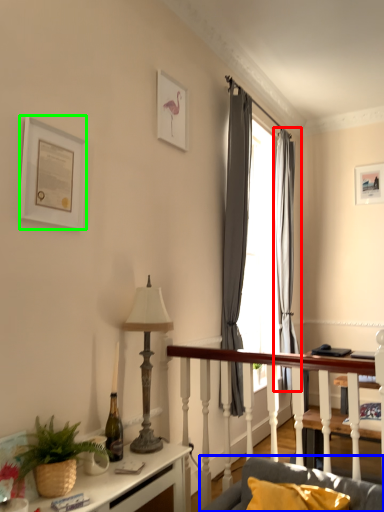
Question: Which object is positioned farthest from curtain (highlighted by a red box)? Select from studio couch (highlighted by a blue box) and picture frame (highlighted by a green box).

Choices:
 (A) studio couch
 (B) picture frame

Answer: (B)